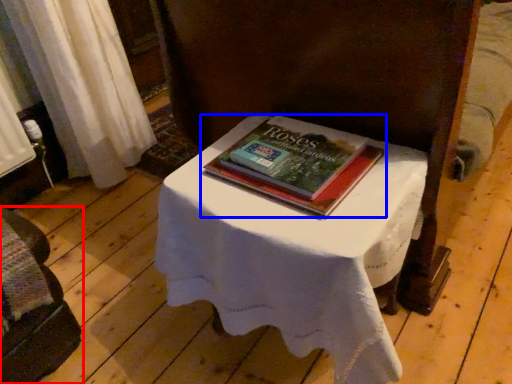
Question: Which object is further to the camera taking this photo, furniture (highlighted by a red box) or book (highlighted by a blue box)?

Choices:
 (A) furniture
 (B) book

Answer: (B)